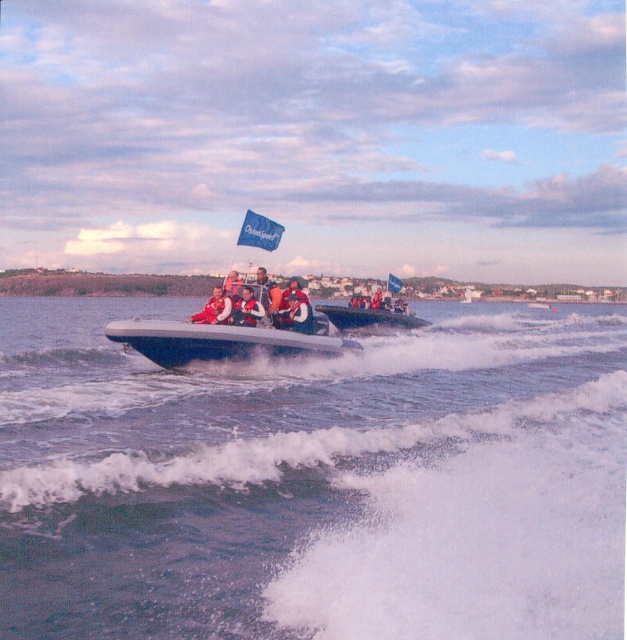
You are navigating a speedboat and need to quickly locate the orange life jacket at center for a passenger. Based on the coordinates provided, can you confirm its position relative to the boat?

The orange life jacket at center is located at coordinates point [218,308], which places it near the middle section of the boat. This position is central and easily accessible for the passenger.

You are a passenger on the speedboat and need to grab a life jacket. The boat is moving fast, so you have to choose quickly. Which life jacket is closer to you, the red fabric life jacket at center or the orange life jacket at center?

The red fabric life jacket at center is closer to you because the orange life jacket at center is positioned behind it.